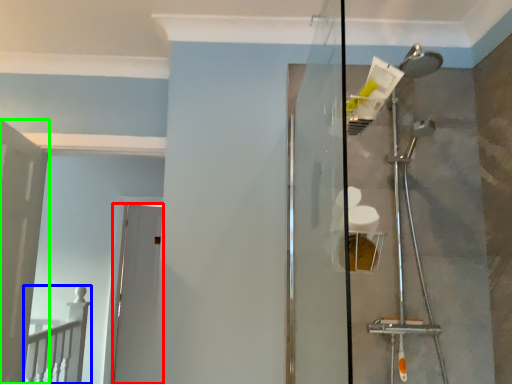
Question: Based on their relative distances, which object is farther from door (highlighted by a red box)? Choose from rail (highlighted by a blue box) and door (highlighted by a green box).

Choices:
 (A) rail
 (B) door

Answer: (B)